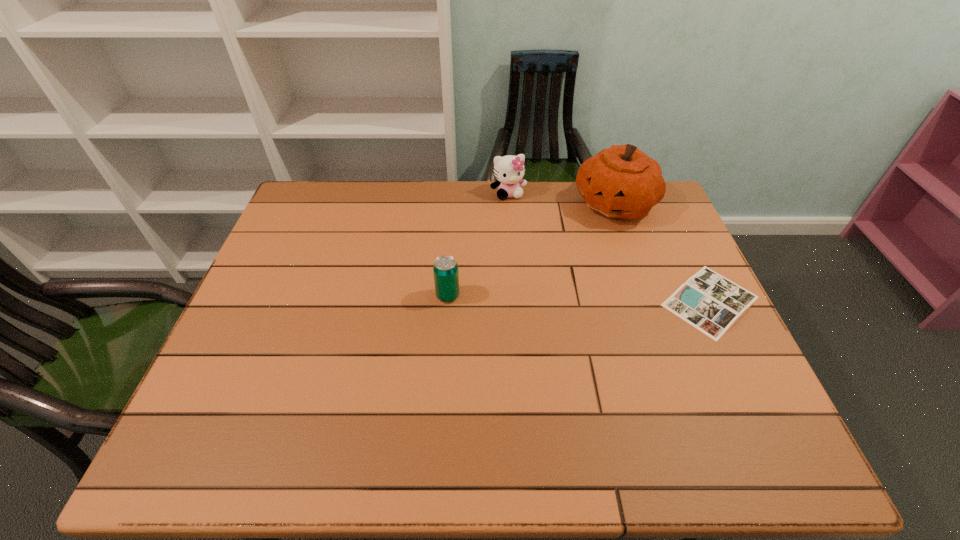
The image size is (960, 540). What are the coordinates of `vacant space located on the front-facing side of the tallest object` in the screenshot? It's located at click(x=588, y=264).

The width and height of the screenshot is (960, 540). I want to click on vacant space located 0.270m on the front-facing side of the kitten, so click(x=532, y=256).

At what (x,y) coordinates should I click in order to perform the action: click on free space located on the front-facing side of the kitten. Please return your answer as a coordinate pair (x, y). Looking at the image, I should click on (517, 217).

Locate an element on the screen. vacant space situated on the front-facing side of the kitten is located at coordinates (542, 284).

Where is `pumpkin that is at the far edge`? The image size is (960, 540). pumpkin that is at the far edge is located at coordinates (622, 182).

Identify the location of kitten that is positioned at the far edge. (509, 170).

You are a GUI agent. You are given a task and a screenshot of the screen. Output one action in this format:
    pyautogui.click(x=<x>, y=<y>)
    Task: Click on the book located at the right edge
    Image resolution: width=960 pixels, height=540 pixels.
    Given the screenshot: What is the action you would take?
    pyautogui.click(x=709, y=302)

Locate an element on the screen. Image resolution: width=960 pixels, height=540 pixels. pumpkin that is positioned at the right edge is located at coordinates (622, 182).

Find the location of a particular element. The width and height of the screenshot is (960, 540). object that is positioned at the far right corner is located at coordinates click(622, 182).

Where is `free space at the far edge of the desktop`? Image resolution: width=960 pixels, height=540 pixels. free space at the far edge of the desktop is located at coordinates (575, 194).